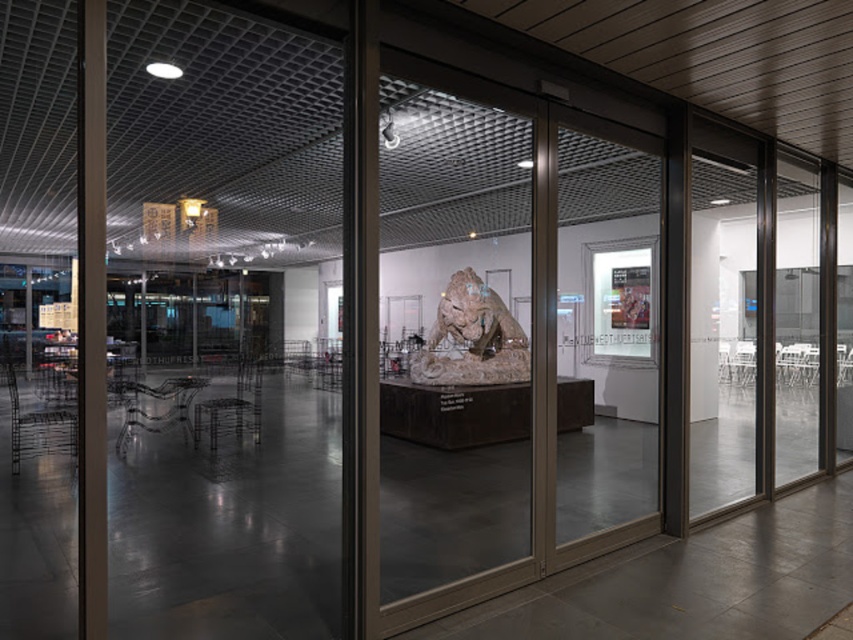
Does point (585, 440) come farther from viewer compared to point (521, 376)?

Yes, point (585, 440) is farther from viewer.

Who is higher up, transparent glass door at center or rustic stone lion at center?

transparent glass door at center is above.

What are the coordinates of `transparent glass door at center` in the screenshot? It's located at tap(509, 337).